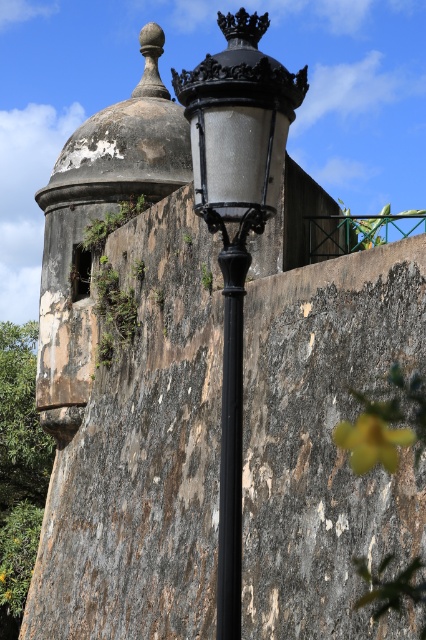
Question: Which object is the closest to the yellow matte flower at lower right?

Choices:
 (A) black metal pole at center
 (B) matte black lamp post at center

Answer: (B)

Question: Is black metal pole at center smaller than yellow matte flower at lower right?

Choices:
 (A) yes
 (B) no

Answer: (B)

Question: In this image, where is black metal pole at center located relative to yellow matte flower at lower right?

Choices:
 (A) above
 (B) below

Answer: (A)

Question: Which object appears farthest from the camera in this image?

Choices:
 (A) yellow matte flower at lower right
 (B) black metal pole at center
 (C) matte black lamp post at center

Answer: (A)

Question: Is black metal pole at center closer to the viewer compared to yellow matte flower at lower right?

Choices:
 (A) no
 (B) yes

Answer: (B)

Question: Which point is closer to the camera?

Choices:
 (A) yellow matte flower at lower right
 (B) black metal pole at center

Answer: (B)